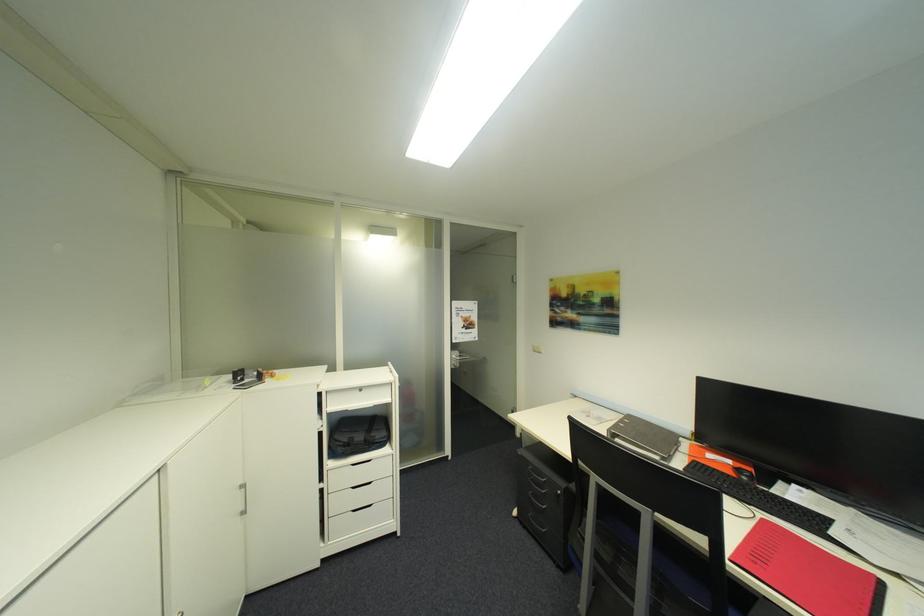
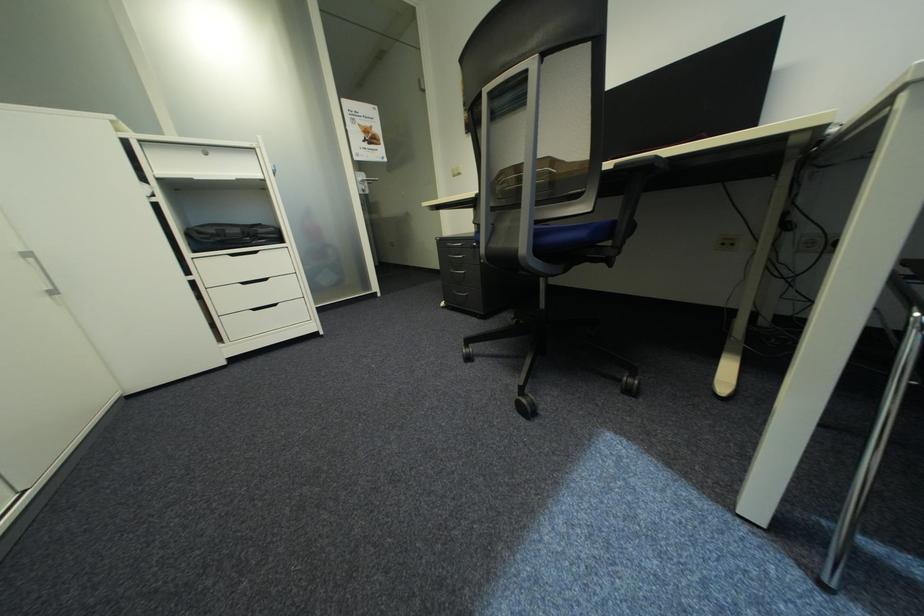
Question: I am providing you with two images of the same scene from different viewpoints. After the viewpoint changes to image2, which objects are now occluded?

Choices:
 (A) orange computer mouse
 (B) black chair armrest
 (C) white cabinet handle
 (D) small book

Answer: (A)